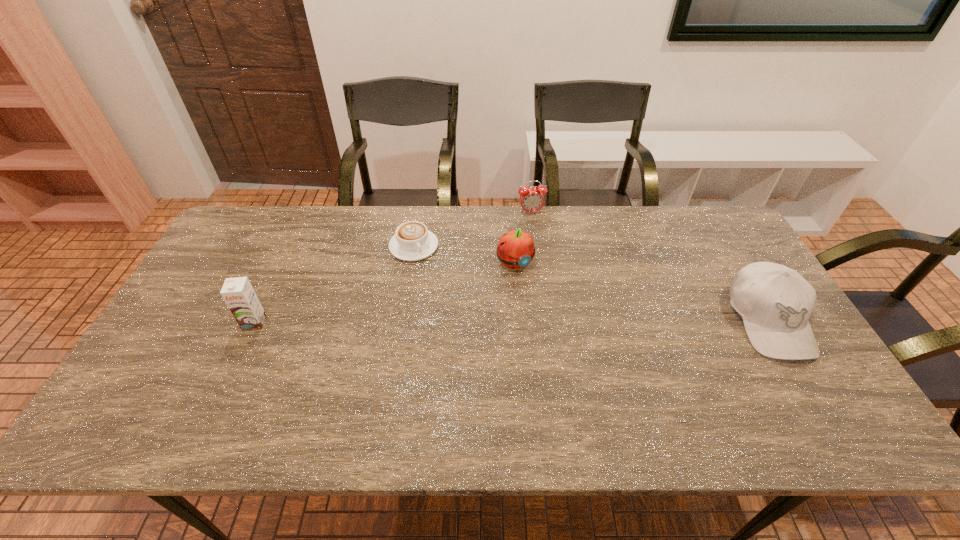
The width and height of the screenshot is (960, 540). What are the coordinates of `object that is at the right edge` in the screenshot? It's located at (775, 302).

In the image, there is a desktop. Identify the location of blank space at the far edge. (645, 207).

Locate an element on the screen. free space at the near edge of the desktop is located at coordinates (393, 390).

Where is `vacant space at the left edge`? Image resolution: width=960 pixels, height=540 pixels. vacant space at the left edge is located at coordinates (165, 334).

At what (x,y) coordinates should I click in order to perform the action: click on vacant region at the right edge of the desktop. Please return your answer as a coordinate pair (x, y). Image resolution: width=960 pixels, height=540 pixels. Looking at the image, I should click on (722, 291).

Find the location of a particular element. vacant area between the shortest object and the leftmost object is located at coordinates (334, 284).

Locate an element on the screen. The width and height of the screenshot is (960, 540). vacant area that lies between the fourth object from right to left and the chocolate milk is located at coordinates (334, 284).

Locate an element on the screen. The width and height of the screenshot is (960, 540). free space between the alarm clock and the chocolate milk is located at coordinates (393, 268).

You are a GUI agent. You are given a task and a screenshot of the screen. Output one action in this format:
    pyautogui.click(x=<x>, y=<y>)
    Task: Click on the unoccupied position between the rightmost object and the chocolate milk
    This screenshot has width=960, height=540.
    Given the screenshot: What is the action you would take?
    pyautogui.click(x=512, y=321)

I want to click on free space that is in between the rightmost object and the apple, so click(641, 292).